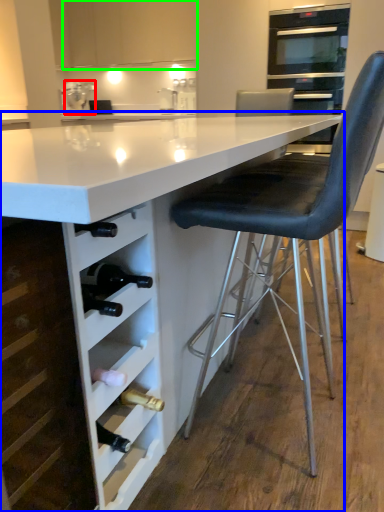
Question: Estimate the real-world distances between objects in this image. Which object is closer to kitchen appliance (highlighted by a red box), table (highlighted by a blue box) or cabinetry (highlighted by a green box)?

Choices:
 (A) table
 (B) cabinetry

Answer: (B)